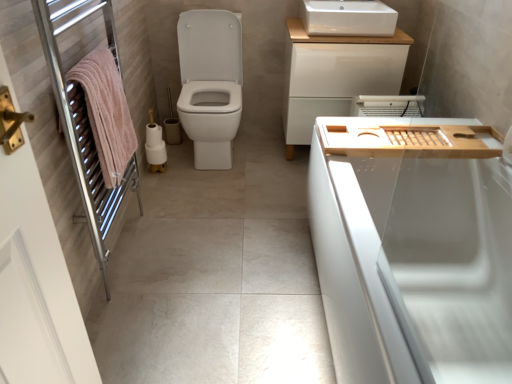
The width and height of the screenshot is (512, 384). I want to click on free region under pink soft towel at left (from a real-world perspective), so click(132, 251).